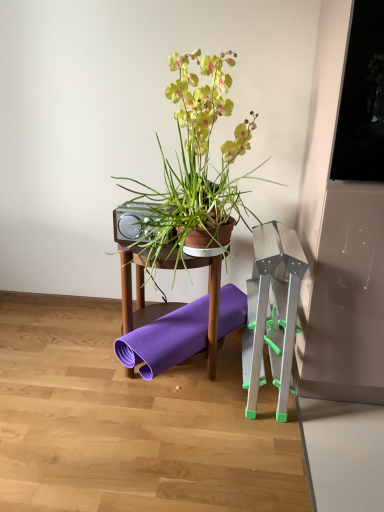
The width and height of the screenshot is (384, 512). I want to click on free space in front of silver metallic step stool at right, so (x=271, y=444).